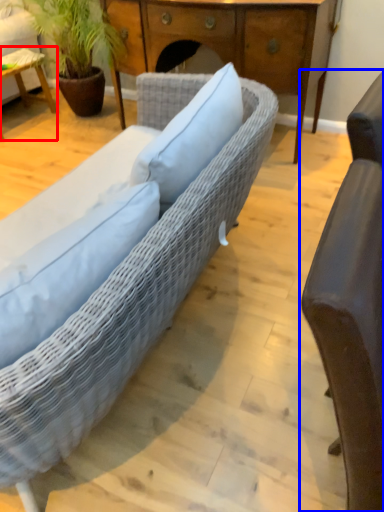
Question: Among these objects, which one is farthest to the camera, table (highlighted by a red box) or chair (highlighted by a blue box)?

Choices:
 (A) table
 (B) chair

Answer: (A)